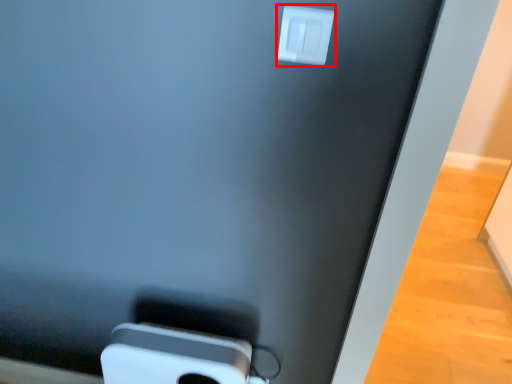
Question: From the image's perspective, where is power plugs and sockets (annotated by the red box) located in relation to ipod in the image?

Choices:
 (A) above
 (B) below

Answer: (A)